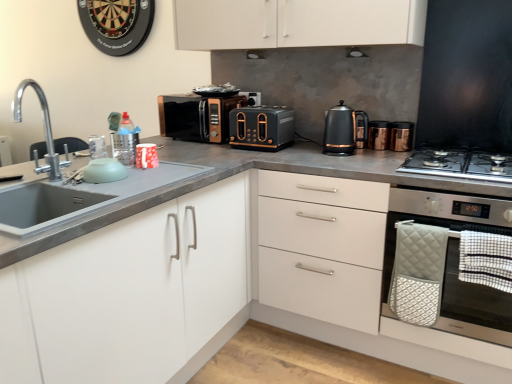
Identify the location of vacant region to the left of gold metallic canister at upper right, the first appliance when ordered from right to left. This screenshot has height=384, width=512. (377, 147).